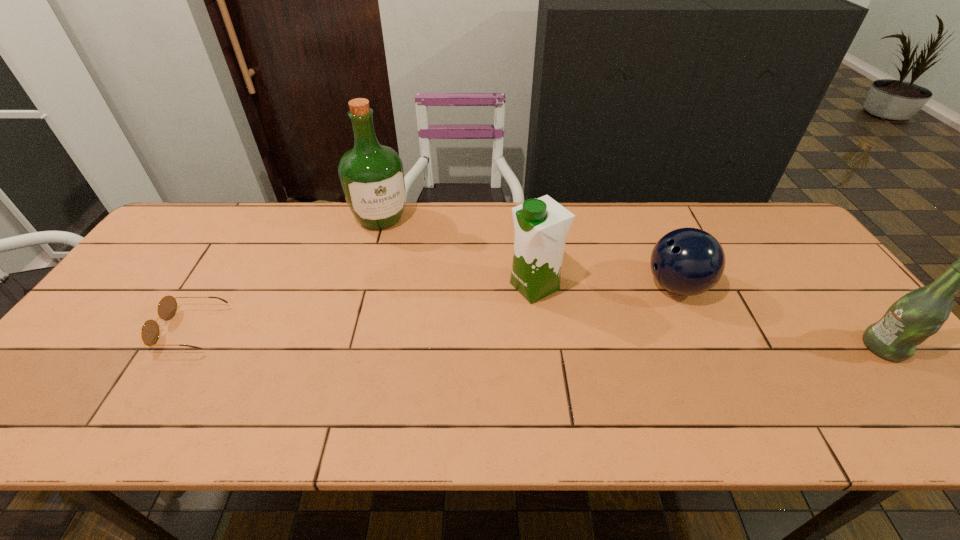
This screenshot has width=960, height=540. In order to click on the shortest object in this screenshot , I will do `click(167, 307)`.

Where is `the leftmost object`? The image size is (960, 540). the leftmost object is located at coordinates (167, 307).

What are the coordinates of `beer bottle` in the screenshot? It's located at (919, 314).

Where is `the second shortest object`? the second shortest object is located at coordinates (687, 261).

At what (x,y) coordinates should I click in order to perform the action: click on bowling ball. Please return your answer as a coordinate pair (x, y). The width and height of the screenshot is (960, 540). Looking at the image, I should click on (687, 261).

Where is `the third object from left to right`? the third object from left to right is located at coordinates (541, 225).

At what (x,y) coordinates should I click in order to perform the action: click on the tallest object. Please return your answer as a coordinate pair (x, y). Image resolution: width=960 pixels, height=540 pixels. Looking at the image, I should click on (372, 177).

Image resolution: width=960 pixels, height=540 pixels. Identify the location of the farthest object. (372, 177).

At what (x,y) coordinates should I click in order to perform the action: click on vacant space located 0.130m on the lenses of the leftmost object. Please return your answer as a coordinate pair (x, y). Looking at the image, I should click on pos(111,329).

At what (x,y) coordinates should I click in order to perform the action: click on vacant space located 0.160m on the lenses of the leftmost object. Please return your answer as a coordinate pair (x, y). This screenshot has width=960, height=540. Looking at the image, I should click on (100, 329).